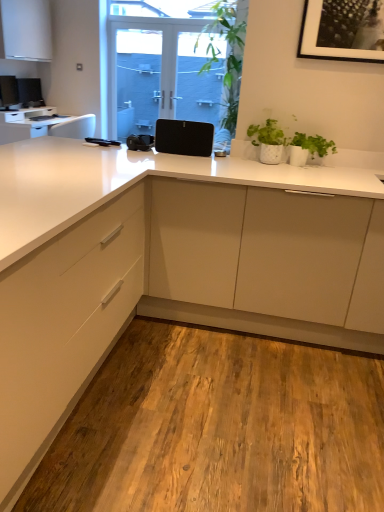
Question: From a real-world perspective, is white glossy countertop at upper left, marked as the first countertop in a top-to-bottom arrangement, on transparent glass screen door at upper center, the 2th screen door positioned from the left?

Choices:
 (A) yes
 (B) no

Answer: (B)

Question: Is white glossy countertop at upper left, the 2th countertop positioned from the front, closer to the viewer compared to transparent glass screen door at upper center, the 2th screen door positioned from the left?

Choices:
 (A) yes
 (B) no

Answer: (A)

Question: Is white glossy countertop at upper left, which is the first countertop in left-to-right order, facing towards transparent glass screen door at upper center, the 2th screen door positioned from the left?

Choices:
 (A) yes
 (B) no

Answer: (B)

Question: Can you confirm if white glossy countertop at upper left, which is the 2th countertop in bottom-to-top order, is taller than transparent glass screen door at upper center, the 2th screen door positioned from the left?

Choices:
 (A) yes
 (B) no

Answer: (B)

Question: Is white glossy countertop at upper left, which is the first countertop in left-to-right order, outside transparent glass screen door at upper center, placed as the 1th screen door when sorted from right to left?

Choices:
 (A) no
 (B) yes

Answer: (B)

Question: From a real-world perspective, relative to white matte drawer at center, is black matte speaker at center vertically above or below?

Choices:
 (A) below
 (B) above

Answer: (B)

Question: Considering the positions of black matte speaker at center and white matte drawer at center in the image, is black matte speaker at center wider or thinner than white matte drawer at center?

Choices:
 (A) thin
 (B) wide

Answer: (A)

Question: Does point pos(158,124) appear closer or farther from the camera than point pos(94,212)?

Choices:
 (A) closer
 (B) farther

Answer: (B)

Question: Looking at the image, does black matte speaker at center seem bigger or smaller compared to white matte drawer at center?

Choices:
 (A) small
 (B) big

Answer: (A)

Question: Based on their positions, is transparent glass screen door at upper center, placed as the 1th screen door when sorted from right to left, located to the left or right of black matte picture frame at upper right?

Choices:
 (A) left
 (B) right

Answer: (A)

Question: Is point (198, 69) positioned closer to the camera than point (365, 26)?

Choices:
 (A) closer
 (B) farther

Answer: (B)

Question: Do you think transparent glass screen door at upper center, the 2th screen door positioned from the left, is within black matte picture frame at upper right, or outside of it?

Choices:
 (A) inside
 (B) outside

Answer: (B)

Question: In the image, is transparent glass screen door at upper center, the 2th screen door positioned from the left, positioned in front of or behind black matte picture frame at upper right?

Choices:
 (A) behind
 (B) front

Answer: (A)

Question: Is black matte picture frame at upper right wider or thinner than green leafy plant at upper center?

Choices:
 (A) thin
 (B) wide

Answer: (A)

Question: Considering the relative positions of black matte picture frame at upper right and green leafy plant at upper center in the image provided, is black matte picture frame at upper right to the left or to the right of green leafy plant at upper center?

Choices:
 (A) right
 (B) left

Answer: (A)